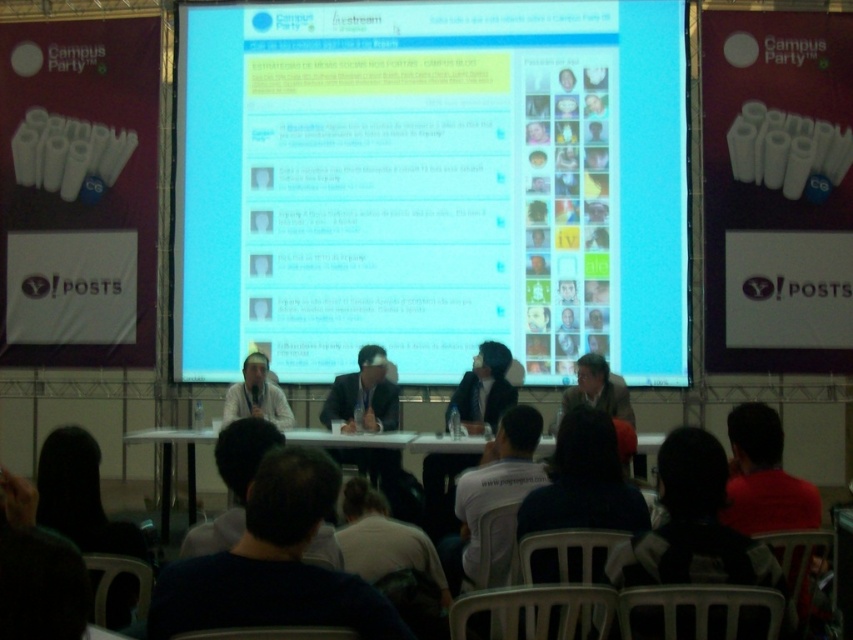
Who is shorter, dark blue shirt at center or light brown leather jacket at center?

With less height is light brown leather jacket at center.

Consider the image. Does dark blue shirt at center have a larger size compared to light brown leather jacket at center?

Indeed, dark blue shirt at center has a larger size compared to light brown leather jacket at center.

From the picture: Who is more forward, (424, 486) or (593, 371)?

Positioned in front is point (424, 486).

This screenshot has height=640, width=853. I want to click on dark blue shirt at center, so click(483, 388).

Consider the image. Which of these two, dark suit at center or white plastic table at center, stands shorter?

Standing shorter between the two is white plastic table at center.

Is dark suit at center smaller than white plastic table at center?

No.

You are a GUI agent. You are given a task and a screenshot of the screen. Output one action in this format:
    pyautogui.click(x=<x>, y=<y>)
    Task: Click on the dark suit at center
    
    Given the screenshot: What is the action you would take?
    pyautogui.click(x=363, y=396)

Between black fabric at lower right and white plastic table at center, which one is positioned lower?

Positioned lower is white plastic table at center.

Can you confirm if black fabric at lower right is positioned above white plastic table at center?

Correct, black fabric at lower right is located above white plastic table at center.

Is point (688, 445) behind point (312, 438)?

No, it is in front of (312, 438).

The width and height of the screenshot is (853, 640). Find the location of `black fabric at lower right`. black fabric at lower right is located at coordinates (693, 525).